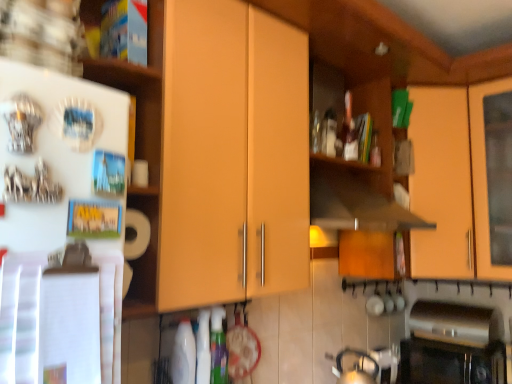
Question: Is matte orange cabinet at upper right, arranged as the first cabinetry when viewed from the right, located outside white paper towel at left, which ranks as the 1th shelf in bottom-to-top order?

Choices:
 (A) no
 (B) yes

Answer: (B)

Question: Is white paper towel at left, the 2th shelf positioned from the top, at the back of matte orange cabinet at upper right, the 1th cabinetry from the back?

Choices:
 (A) yes
 (B) no

Answer: (B)

Question: Are matte orange cabinet at upper right, the second cabinetry from the front, and white paper towel at left, the 2th shelf positioned from the top, far apart?

Choices:
 (A) no
 (B) yes

Answer: (B)

Question: Can white paper towel at left, the 2th shelf positioned from the top, be found inside matte orange cabinet at upper right, arranged as the first cabinetry when viewed from the right?

Choices:
 (A) yes
 (B) no

Answer: (B)

Question: Does matte orange cabinet at upper right, the 1th cabinetry from the back, have a greater width compared to white paper towel at left, which ranks as the 1th shelf in bottom-to-top order?

Choices:
 (A) no
 (B) yes

Answer: (B)

Question: Is matte orange cabinet at upper right, placed as the second cabinetry when sorted from left to right, situated inside silver metallic tea pot at lower right or outside?

Choices:
 (A) inside
 (B) outside

Answer: (B)

Question: From the image's perspective, is matte orange cabinet at upper right, the 1th cabinetry from the back, above or below silver metallic tea pot at lower right?

Choices:
 (A) above
 (B) below

Answer: (A)

Question: In the image, is matte orange cabinet at upper right, the 1th cabinetry from the back, on the left side or the right side of silver metallic tea pot at lower right?

Choices:
 (A) right
 (B) left

Answer: (A)

Question: In terms of width, does matte orange cabinet at upper right, arranged as the first cabinetry when viewed from the right, look wider or thinner when compared to silver metallic tea pot at lower right?

Choices:
 (A) thin
 (B) wide

Answer: (B)

Question: Considering the positions of point (159, 155) and point (426, 364), is point (159, 155) closer or farther from the camera than point (426, 364)?

Choices:
 (A) farther
 (B) closer

Answer: (B)

Question: Is white paper towel at left, which ranks as the 1th shelf in bottom-to-top order, spatially inside black glass oven at lower right, or outside of it?

Choices:
 (A) inside
 (B) outside

Answer: (B)

Question: Considering the positions of white paper towel at left, the 2th shelf positioned from the top, and black glass oven at lower right in the image, is white paper towel at left, the 2th shelf positioned from the top, wider or thinner than black glass oven at lower right?

Choices:
 (A) thin
 (B) wide

Answer: (B)

Question: From the image's perspective, is white paper towel at left, which ranks as the 1th shelf in bottom-to-top order, above or below black glass oven at lower right?

Choices:
 (A) above
 (B) below

Answer: (A)

Question: From a real-world perspective, relative to wooden cabinet door at upper left, the 2th shelf positioned from the bottom, is matte wood cabinet at center, acting as the 2th cabinetry starting from the back, vertically above or below?

Choices:
 (A) above
 (B) below

Answer: (B)

Question: In terms of width, does matte wood cabinet at center, which is the first cabinetry from front to back, look wider or thinner when compared to wooden cabinet door at upper left, which ranks as the first shelf in top-to-bottom order?

Choices:
 (A) wide
 (B) thin

Answer: (A)